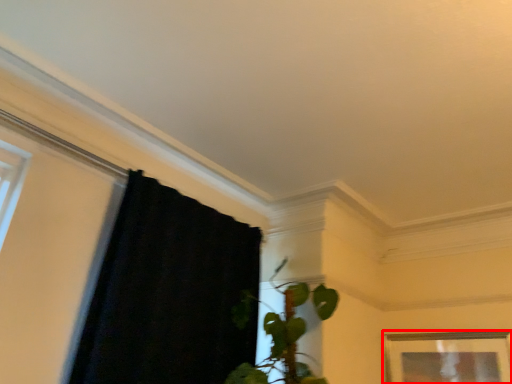
Question: From the image's perspective, where is picture frame (annotated by the red box) located relative to curtain?

Choices:
 (A) above
 (B) below

Answer: (B)